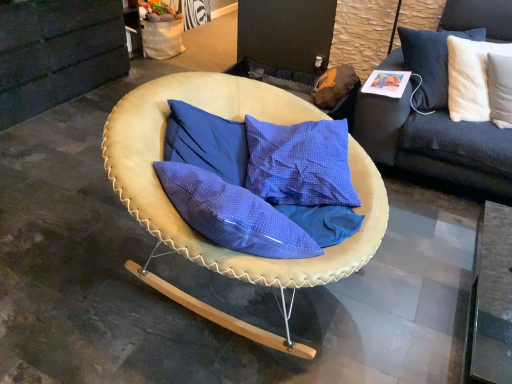
Question: Is dark gray fabric couch at upper right smaller than white soft cushion at upper right?

Choices:
 (A) no
 (B) yes

Answer: (A)

Question: Is dark gray fabric couch at upper right surrounding white soft cushion at upper right?

Choices:
 (A) no
 (B) yes

Answer: (B)

Question: Is dark gray fabric couch at upper right taller than white soft cushion at upper right?

Choices:
 (A) no
 (B) yes

Answer: (B)

Question: Can you confirm if dark gray fabric couch at upper right is wider than white soft cushion at upper right?

Choices:
 (A) yes
 (B) no

Answer: (A)

Question: Does dark gray fabric couch at upper right lie behind white soft cushion at upper right?

Choices:
 (A) yes
 (B) no

Answer: (A)

Question: From their relative heights in the image, would you say dark gray fabric couch at upper right is taller or shorter than leather-like beige chair at center?

Choices:
 (A) short
 (B) tall

Answer: (B)

Question: Looking at their shapes, would you say dark gray fabric couch at upper right is wider or thinner than leather-like beige chair at center?

Choices:
 (A) thin
 (B) wide

Answer: (B)

Question: Is dark gray fabric couch at upper right in front of or behind leather-like beige chair at center in the image?

Choices:
 (A) front
 (B) behind

Answer: (B)

Question: Would you say dark gray fabric couch at upper right is inside or outside leather-like beige chair at center?

Choices:
 (A) inside
 (B) outside

Answer: (B)

Question: Looking at the image, does white soft cushion at upper right seem bigger or smaller compared to leather-like beige chair at center?

Choices:
 (A) big
 (B) small

Answer: (B)

Question: From a real-world perspective, is white soft cushion at upper right physically located above or below leather-like beige chair at center?

Choices:
 (A) above
 (B) below

Answer: (A)

Question: Do you think white soft cushion at upper right is within leather-like beige chair at center, or outside of it?

Choices:
 (A) inside
 (B) outside

Answer: (B)

Question: Considering the positions of point (450, 91) and point (370, 208), is point (450, 91) closer or farther from the camera than point (370, 208)?

Choices:
 (A) farther
 (B) closer

Answer: (A)

Question: Choose the correct answer: Is dark gray fabric couch at upper right inside white soft cushion at upper right or outside it?

Choices:
 (A) inside
 (B) outside

Answer: (B)

Question: Considering their positions, is dark gray fabric couch at upper right located in front of or behind white soft cushion at upper right?

Choices:
 (A) behind
 (B) front

Answer: (A)